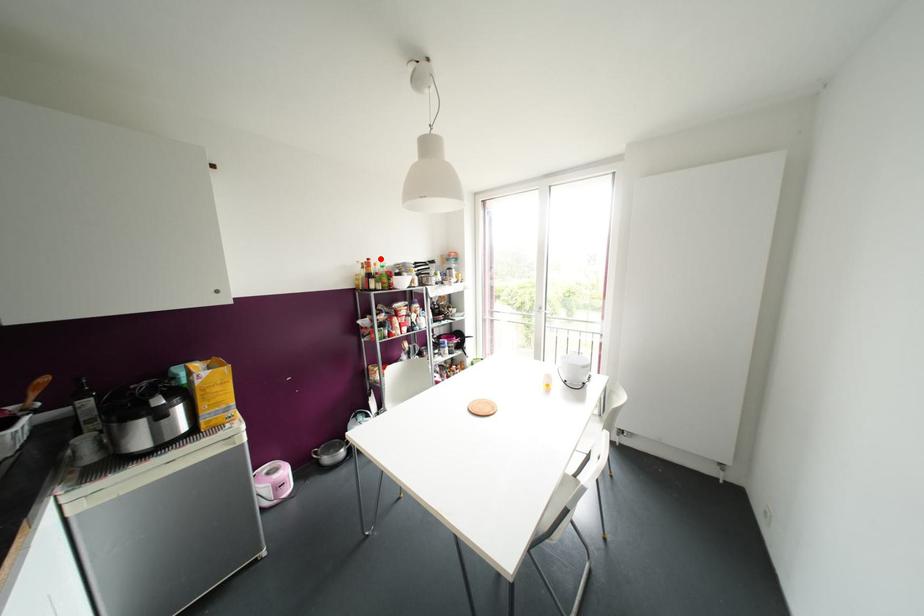
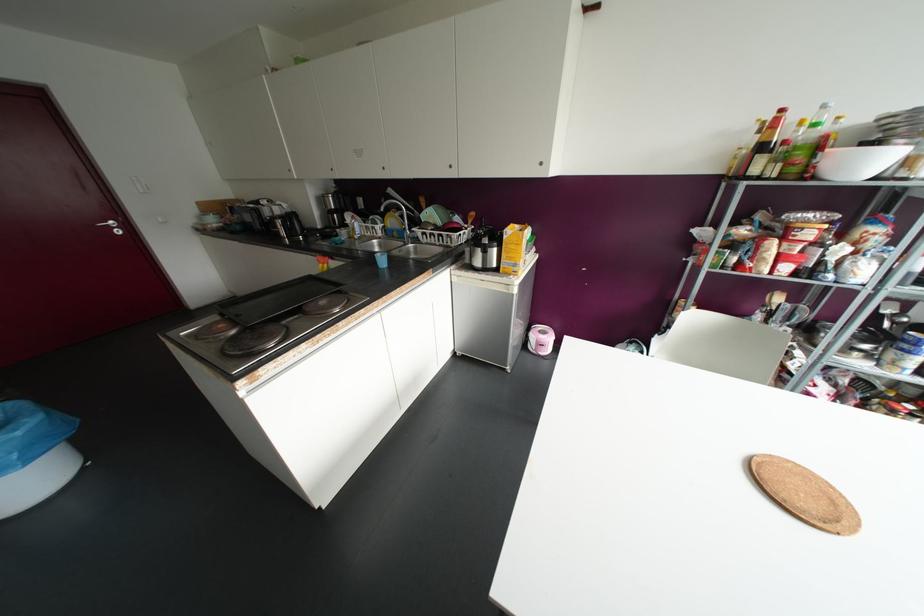
In the second image, find the point that corresponds to the highlighted location in the first image.

(823, 106)